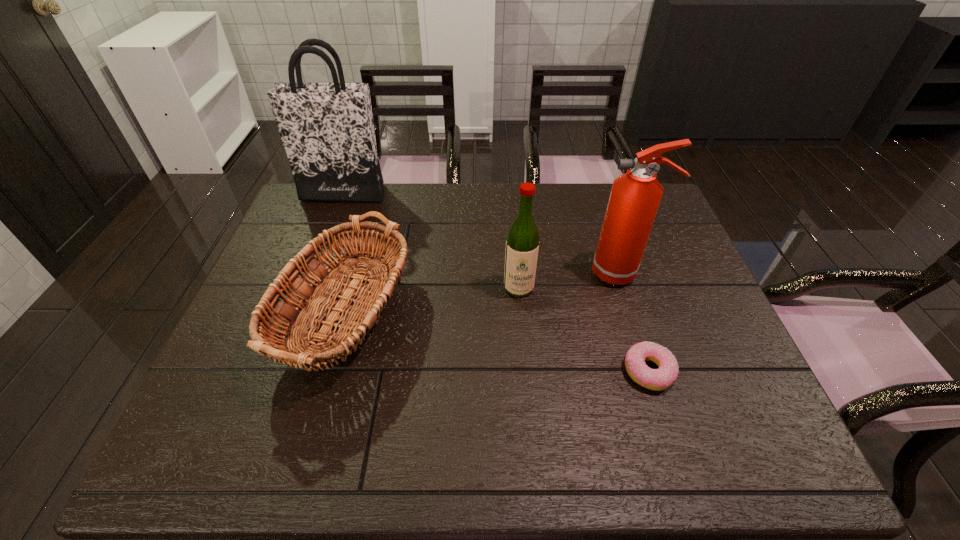
Image resolution: width=960 pixels, height=540 pixels. I want to click on vacant area that satisfies the following two spatial constraints: 1. on the front side of the basket; 2. on the left side of the doughnut, so click(x=321, y=371).